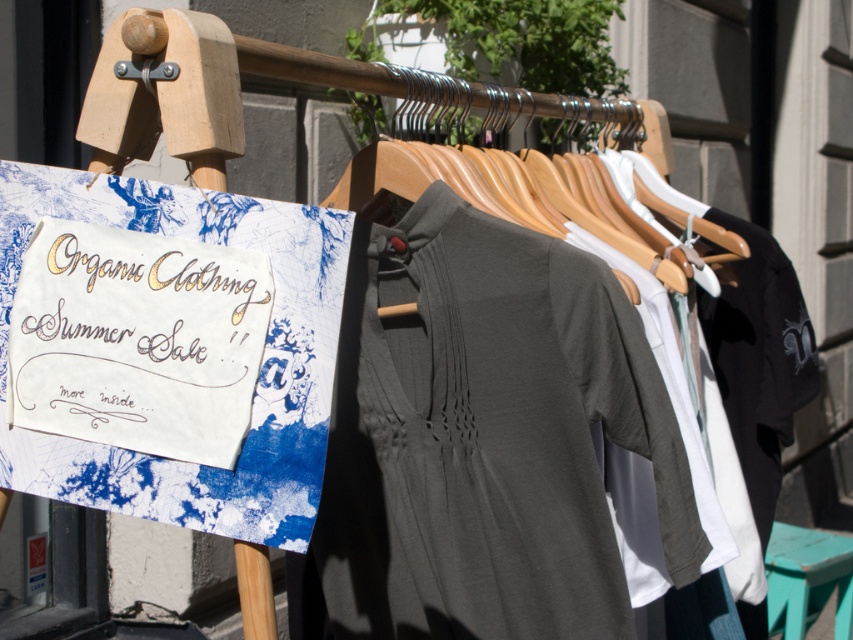
Question: Can you confirm if dark gray jersey dress at center is smaller than teal wood stool at lower right?

Choices:
 (A) no
 (B) yes

Answer: (A)

Question: Estimate the real-world distances between objects in this image. Which object is farther from the teal wood stool at lower right?

Choices:
 (A) gold calligraphy sign at upper left
 (B) dark gray jersey dress at center

Answer: (A)

Question: Can you confirm if gold calligraphy sign at upper left is thinner than wooden hanger at center?

Choices:
 (A) yes
 (B) no

Answer: (A)

Question: Which of these objects is positioned farthest from the gold calligraphy sign at upper left?

Choices:
 (A) teal wood stool at lower right
 (B) wooden hanger at center
 (C) dark gray jersey dress at center

Answer: (A)

Question: Does dark gray jersey dress at center have a smaller size compared to teal wood stool at lower right?

Choices:
 (A) yes
 (B) no

Answer: (B)

Question: Which point appears farthest from the camera in this image?

Choices:
 (A) (669, 522)
 (B) (706, 225)
 (C) (201, 339)
 (D) (850, 608)

Answer: (D)